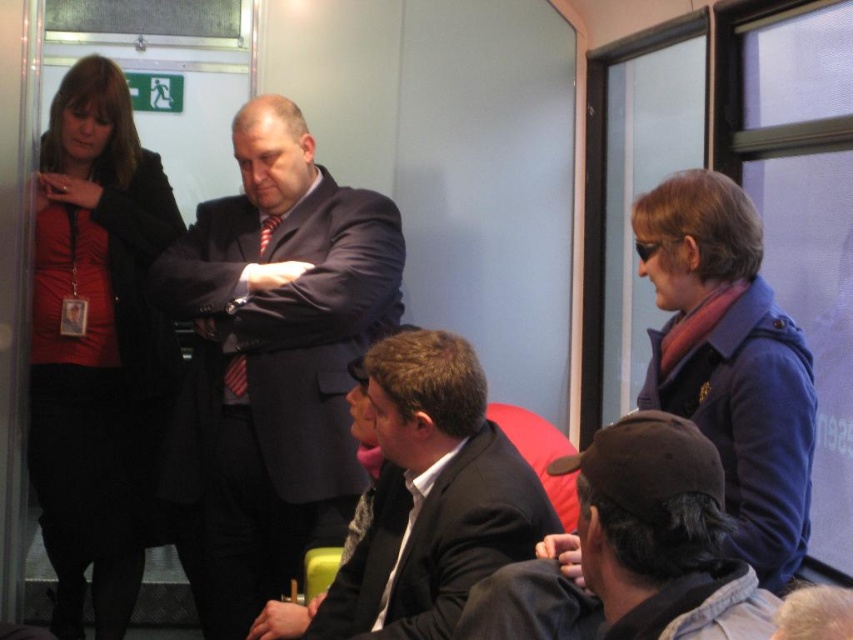
You are a passenger trying to find a spot to place your new rectangular briefcase. You notice the matte black suit at center and the dark brown leather cap at lower right. Which object has a wider base to support the briefcase?

The matte black suit at center has a wider base than the dark brown leather cap at lower right, so it can support the briefcase better.

You are a passenger on a train and need to choose a seat. There are two options available in the center area of the train car. One is labeled as the dark blue suit at center and the other as the matte black suit at center. Based on their sizes, which one would you choose if you prefer a larger seat?

The dark blue suit at center is bigger than the matte black suit at center, so you should choose the dark blue suit at center for a larger seat.

You are a passenger on a train and you want to move from the left side of the train to the right side. There are two objects in your path, the matte black jacket at left and the dark brown leather cap at lower right. Which object should you avoid stepping over to reach the right side?

The matte black jacket at left is positioned on the left side of dark brown leather cap at lower right. To move to the right side, avoid stepping over the matte black jacket at left first, then proceed past the dark brown leather cap at lower right.